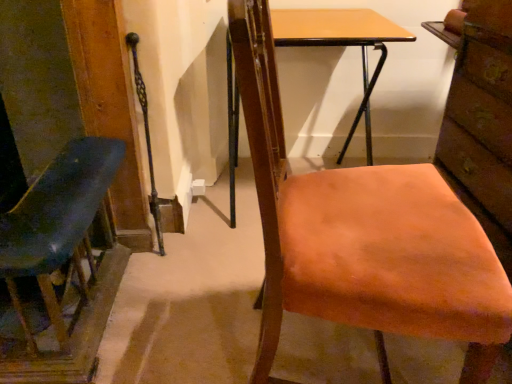
Find the location of a particular element. orange fabric chair at center, which is the first chair from right to left is located at coordinates (315, 194).

What do you see at coordinates (341, 46) in the screenshot? I see `light brown wood desk at center` at bounding box center [341, 46].

Where is `orange fabric chair at center, which is the first chair from right to left`? The width and height of the screenshot is (512, 384). orange fabric chair at center, which is the first chair from right to left is located at coordinates (315, 194).

Based on the photo, is matte blue chair at left, arranged as the first chair when viewed from the left, spatially inside orange fabric chair at center, which ranks as the 2th chair in left-to-right order, or outside of it?

matte blue chair at left, arranged as the first chair when viewed from the left, is outside orange fabric chair at center, which ranks as the 2th chair in left-to-right order.

Is matte blue chair at left, the second chair when ordered from right to left, looking in the opposite direction of orange fabric chair at center, which ranks as the 2th chair in left-to-right order?

No.

From the image's perspective, which is below, matte blue chair at left, arranged as the first chair when viewed from the left, or orange fabric chair at center, which ranks as the 2th chair in left-to-right order?

matte blue chair at left, arranged as the first chair when viewed from the left.

Where is `desk above the matte blue chair at left, the second chair when ordered from right to left (from the image's perspective)`? This screenshot has height=384, width=512. desk above the matte blue chair at left, the second chair when ordered from right to left (from the image's perspective) is located at coordinates (341, 46).

Is matte blue chair at left, arranged as the first chair when viewed from the left, looking in the opposite direction of light brown wood desk at center?

No, matte blue chair at left, arranged as the first chair when viewed from the left, is not facing away from light brown wood desk at center.

Relative to light brown wood desk at center, is matte blue chair at left, arranged as the first chair when viewed from the left, in front or behind?

Visually, matte blue chair at left, arranged as the first chair when viewed from the left, is located in front of light brown wood desk at center.

Considering the relative positions of matte blue chair at left, the second chair when ordered from right to left, and light brown wood desk at center in the image provided, is matte blue chair at left, the second chair when ordered from right to left, to the left of light brown wood desk at center from the viewer's perspective?

Indeed, matte blue chair at left, the second chair when ordered from right to left, is positioned on the left side of light brown wood desk at center.

Identify the location of desk that is under the orange fabric chair at center, which ranks as the 2th chair in left-to-right order (from a real-world perspective). The height and width of the screenshot is (384, 512). (341, 46).

Which object is positioned more to the left, orange fabric chair at center, which is the first chair from right to left, or light brown wood desk at center?

Positioned to the left is light brown wood desk at center.

Consider the image. Is orange fabric chair at center, which ranks as the 2th chair in left-to-right order, positioned with its back to light brown wood desk at center?

orange fabric chair at center, which ranks as the 2th chair in left-to-right order, is not turned away from light brown wood desk at center.

Is orange fabric chair at center, which ranks as the 2th chair in left-to-right order, directly adjacent to light brown wood desk at center?

There is a gap between orange fabric chair at center, which ranks as the 2th chair in left-to-right order, and light brown wood desk at center.

Is brick textured drawer at right situated inside matte blue chair at left, arranged as the first chair when viewed from the left, or outside?

brick textured drawer at right is located beyond the bounds of matte blue chair at left, arranged as the first chair when viewed from the left.

Based on the photo, would you consider brick textured drawer at right to be distant from matte blue chair at left, arranged as the first chair when viewed from the left?

brick textured drawer at right is positioned a significant distance from matte blue chair at left, arranged as the first chair when viewed from the left.

Which object is positioned more to the right, brick textured drawer at right or matte blue chair at left, the second chair when ordered from right to left?

brick textured drawer at right is more to the right.

Between brick textured drawer at right and matte blue chair at left, arranged as the first chair when viewed from the left, which one has larger width?

matte blue chair at left, arranged as the first chair when viewed from the left.

Based on the photo, is light brown wood desk at center completely or partially outside of brick textured drawer at right?

Yes, light brown wood desk at center is located beyond the bounds of brick textured drawer at right.

Considering their positions, is light brown wood desk at center located in front of or behind brick textured drawer at right?

light brown wood desk at center is in front of brick textured drawer at right.

Considering the relative sizes of light brown wood desk at center and brick textured drawer at right in the image provided, is light brown wood desk at center taller than brick textured drawer at right?

Indeed, light brown wood desk at center has a greater height compared to brick textured drawer at right.

Find the location of a particular element. The height and width of the screenshot is (384, 512). desk on the left of brick textured drawer at right is located at coordinates (341, 46).

Is point (397, 241) positioned in front of point (489, 60)?

That is True.

Are orange fabric chair at center, which ranks as the 2th chair in left-to-right order, and brick textured drawer at right far apart?

orange fabric chair at center, which ranks as the 2th chair in left-to-right order, is actually quite close to brick textured drawer at right.

Is the depth of orange fabric chair at center, which is the first chair from right to left, greater than that of brick textured drawer at right?

That is False.

Is orange fabric chair at center, which is the first chair from right to left, to the left of brick textured drawer at right from the viewer's perspective?

Correct, you'll find orange fabric chair at center, which is the first chair from right to left, to the left of brick textured drawer at right.

This screenshot has height=384, width=512. Find the location of `the 1st chair in front of the light brown wood desk at center, starting your count from the anchor`. the 1st chair in front of the light brown wood desk at center, starting your count from the anchor is located at coordinates (63, 260).

Can you confirm if light brown wood desk at center is taller than matte blue chair at left, arranged as the first chair when viewed from the left?

Correct, light brown wood desk at center is much taller as matte blue chair at left, arranged as the first chair when viewed from the left.

Between light brown wood desk at center and matte blue chair at left, the second chair when ordered from right to left, which one is positioned in front?

Positioned in front is matte blue chair at left, the second chair when ordered from right to left.

From a real-world perspective, between light brown wood desk at center and matte blue chair at left, the second chair when ordered from right to left, who is vertically lower?

In real-world perspective, matte blue chair at left, the second chair when ordered from right to left, is lower.

Locate an element on the screen. chair on the left side of orange fabric chair at center, which ranks as the 2th chair in left-to-right order is located at coordinates (63, 260).

You are a GUI agent. You are given a task and a screenshot of the screen. Output one action in this format:
    pyautogui.click(x=<x>, y=<y>)
    Task: Click on the desk above the matte blue chair at left, arranged as the first chair when viewed from the left (from a real-world perspective)
    
    Given the screenshot: What is the action you would take?
    pyautogui.click(x=341, y=46)

Considering their positions, is light brown wood desk at center positioned further to orange fabric chair at center, which ranks as the 2th chair in left-to-right order, than brick textured drawer at right?

Among the two, light brown wood desk at center is located further to orange fabric chair at center, which ranks as the 2th chair in left-to-right order.

Looking at the image, which one is located closer to light brown wood desk at center, orange fabric chair at center, which ranks as the 2th chair in left-to-right order, or matte blue chair at left, the second chair when ordered from right to left?

orange fabric chair at center, which ranks as the 2th chair in left-to-right order, lies closer to light brown wood desk at center than the other object.

Which object lies further to the anchor point matte blue chair at left, arranged as the first chair when viewed from the left, brick textured drawer at right or orange fabric chair at center, which is the first chair from right to left?

Among the two, brick textured drawer at right is located further to matte blue chair at left, arranged as the first chair when viewed from the left.

From the image, which object appears to be nearer to brick textured drawer at right, light brown wood desk at center or orange fabric chair at center, which is the first chair from right to left?

The object closer to brick textured drawer at right is orange fabric chair at center, which is the first chair from right to left.

Estimate the real-world distances between objects in this image. Which object is closer to matte blue chair at left, the second chair when ordered from right to left, brick textured drawer at right or light brown wood desk at center?

light brown wood desk at center.

Estimate the real-world distances between objects in this image. Which object is closer to brick textured drawer at right, orange fabric chair at center, which is the first chair from right to left, or light brown wood desk at center?

Based on the image, orange fabric chair at center, which is the first chair from right to left, appears to be nearer to brick textured drawer at right.

Looking at the image, which one is located further to matte blue chair at left, the second chair when ordered from right to left, orange fabric chair at center, which is the first chair from right to left, or light brown wood desk at center?

Based on the image, light brown wood desk at center appears to be further to matte blue chair at left, the second chair when ordered from right to left.

In the scene shown: From the image, which object appears to be farther from light brown wood desk at center, brick textured drawer at right or orange fabric chair at center, which ranks as the 2th chair in left-to-right order?

Based on the image, orange fabric chair at center, which ranks as the 2th chair in left-to-right order, appears to be further to light brown wood desk at center.

At what (x,y) coordinates should I click in order to perform the action: click on chair between matte blue chair at left, the second chair when ordered from right to left, and brick textured drawer at right. Please return your answer as a coordinate pair (x, y). Looking at the image, I should click on (315, 194).

Where is `desk between orange fabric chair at center, which is the first chair from right to left, and brick textured drawer at right, along the z-axis`? desk between orange fabric chair at center, which is the first chair from right to left, and brick textured drawer at right, along the z-axis is located at coordinates (341, 46).

Where is `desk located between matte blue chair at left, arranged as the first chair when viewed from the left, and brick textured drawer at right in the left-right direction`? The width and height of the screenshot is (512, 384). desk located between matte blue chair at left, arranged as the first chair when viewed from the left, and brick textured drawer at right in the left-right direction is located at coordinates pos(341,46).

The width and height of the screenshot is (512, 384). I want to click on desk between matte blue chair at left, arranged as the first chair when viewed from the left, and orange fabric chair at center, which is the first chair from right to left, from left to right, so click(341, 46).